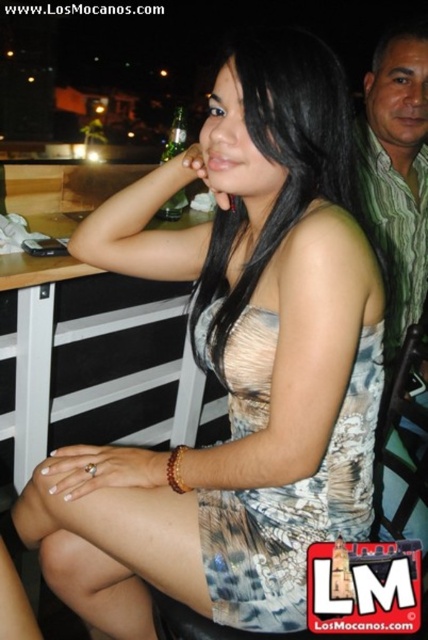
Does printed fabric dress at center appear on the right side of green striped shirt at right?

In fact, printed fabric dress at center is to the left of green striped shirt at right.

Is printed fabric dress at center bigger than green striped shirt at right?

No.

Which is behind, point (371, 515) or point (401, 214)?

Point (401, 214)

The width and height of the screenshot is (428, 640). Identify the location of printed fabric dress at center. (294, 513).

Is printed fabric dress at center taller than white wood table at center?

No, printed fabric dress at center is not taller than white wood table at center.

Is printed fabric dress at center smaller than white wood table at center?

Indeed, printed fabric dress at center has a smaller size compared to white wood table at center.

Describe the element at coordinates (294, 513) in the screenshot. I see `printed fabric dress at center` at that location.

At what (x,y) coordinates should I click in order to perform the action: click on printed fabric dress at center. Please return your answer as a coordinate pair (x, y). Looking at the image, I should click on (294, 513).

Does green striped shirt at right appear on the left side of white wood table at center?

In fact, green striped shirt at right is to the right of white wood table at center.

Does green striped shirt at right have a greater width compared to white wood table at center?

In fact, green striped shirt at right might be narrower than white wood table at center.

This screenshot has width=428, height=640. What do you see at coordinates (398, 172) in the screenshot?
I see `green striped shirt at right` at bounding box center [398, 172].

I want to click on green striped shirt at right, so click(x=398, y=172).